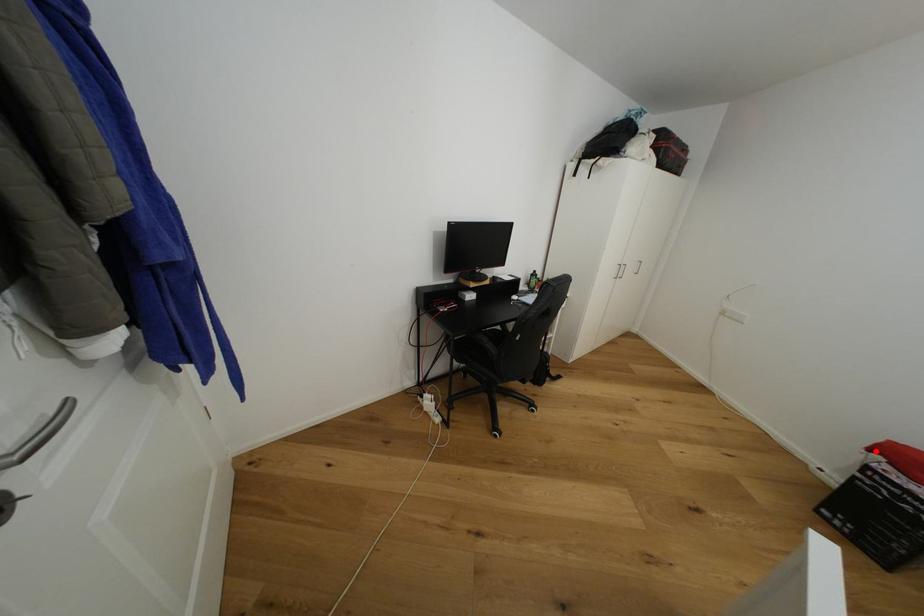
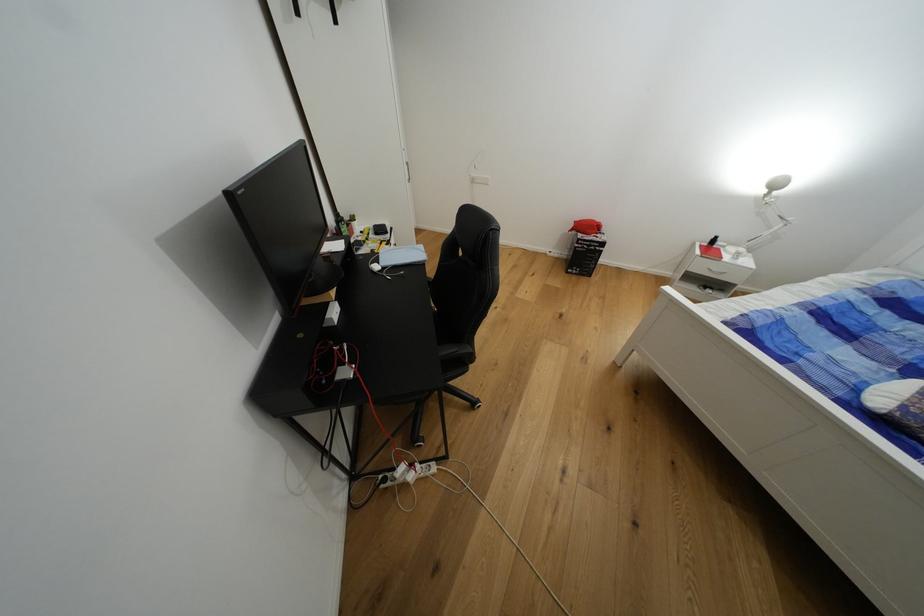
Question: A red point is marked in image1. In image2, is the corresponding 3D point closer to the camera or farther? Reply with the corresponding letter.

Choices:
 (A) The corresponding 3D point is closer.
 (B) The corresponding 3D point is farther.

Answer: (A)